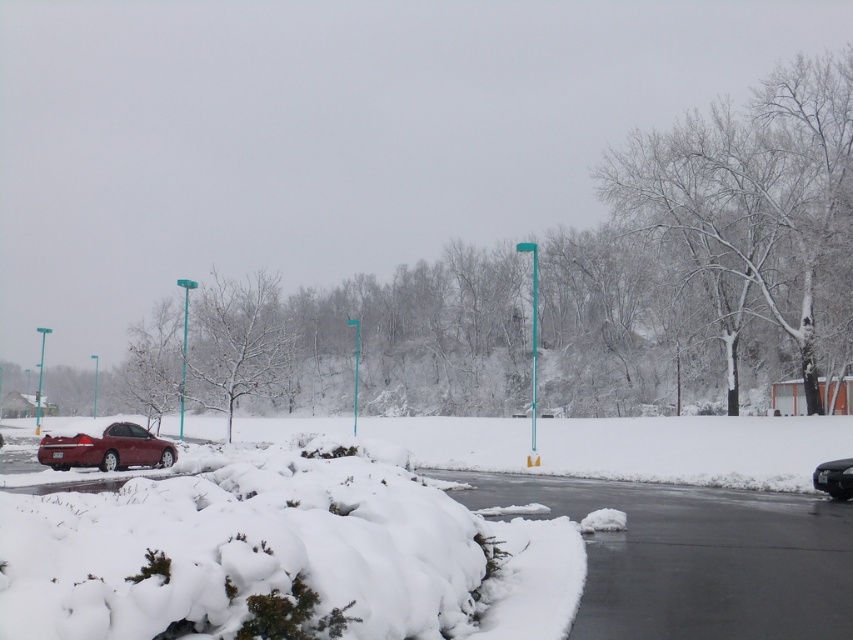
You are a delivery driver who needs to park your truck between the shiny red sedan at left and the shiny black sedan at lower right. Given that your truck is 2 meters tall, can you safely park there without hitting the roof?

The shiny red sedan at left is much taller than the shiny black sedan at lower right. Since the red sedan is taller, the parking space might have enough height for the truck, but since the description only mentions their relative heights and not the actual clearance, it is uncertain. However, if the taller red sedan was parked there, it implies the space can accommodate its height. Assuming the truck is shorter than the red sedan, which is 2 meters, then yes, it can park safely.

You are standing in the snowy landscape and want to move from the shiny red sedan at left to the shiny black sedan at lower right. Which direction should you head towards?

You should head downward because the shiny red sedan at left is located above the shiny black sedan at lower right.